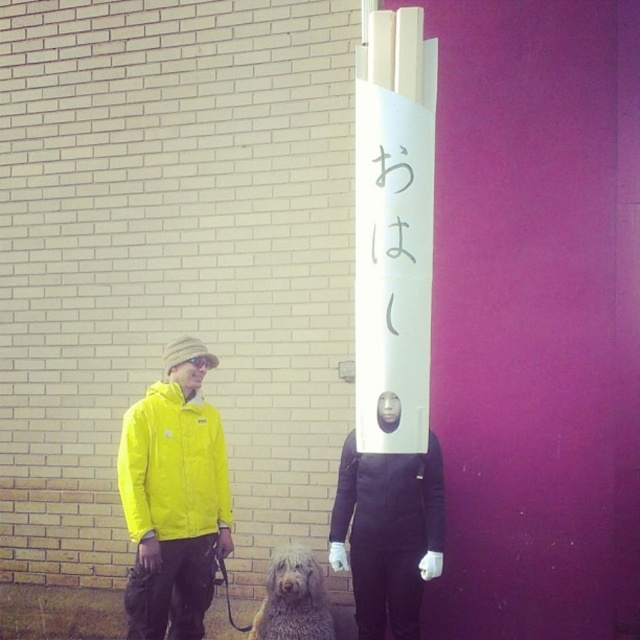
Is yellow matte jacket at left wider than gray shaggy dog at lower center?

Correct, the width of yellow matte jacket at left exceeds that of gray shaggy dog at lower center.

What do you see at coordinates (172, 467) in the screenshot? I see `yellow matte jacket at left` at bounding box center [172, 467].

Is point (164, 476) positioned before point (301, 620)?

That is False.

The height and width of the screenshot is (640, 640). I want to click on yellow matte jacket at left, so click(172, 467).

Is black matte jacket at center closer to the viewer compared to gray shaggy dog at lower center?

Yes, black matte jacket at center is in front of gray shaggy dog at lower center.

In the scene shown: Between black matte jacket at center and gray shaggy dog at lower center, which one appears on the left side from the viewer's perspective?

gray shaggy dog at lower center

Which is in front, point (429, 454) or point (321, 604)?

Positioned in front is point (429, 454).

Identify the location of black matte jacket at center. 388,499.

What are the coordinates of `yellow matte jacket at left` in the screenshot? It's located at (172, 467).

Which is more to the left, yellow matte jacket at left or black matte jacket at center?

yellow matte jacket at left

Who is more forward, (x=144, y=483) or (x=365, y=532)?

Positioned in front is point (x=365, y=532).

The height and width of the screenshot is (640, 640). What are the coordinates of `yellow matte jacket at left` in the screenshot? It's located at (172, 467).